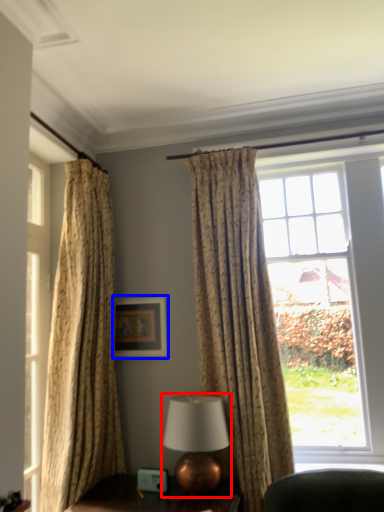
Question: Among these objects, which one is nearest to the camera, table lamp (highlighted by a red box) or picture frame (highlighted by a blue box)?

Choices:
 (A) table lamp
 (B) picture frame

Answer: (A)